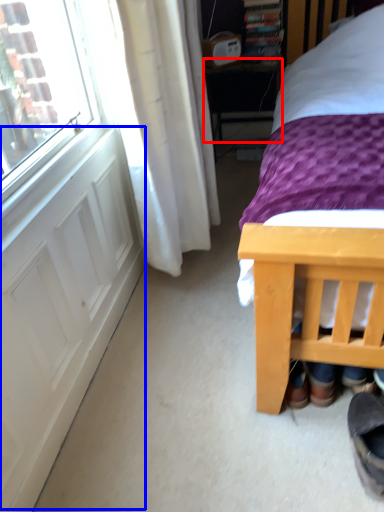
Question: Which point is closer to the camera, table (highlighted by a red box) or screen door (highlighted by a blue box)?

Choices:
 (A) table
 (B) screen door

Answer: (B)